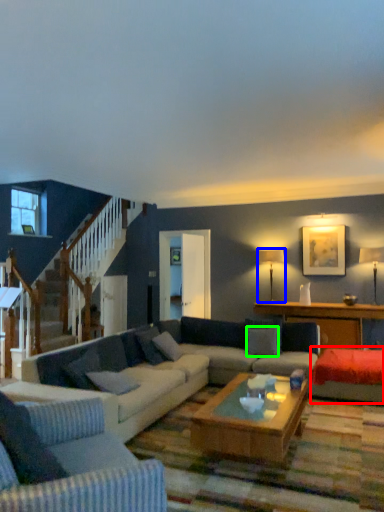
Question: Based on their relative distances, which object is nearer to couch (highlighted by a red box)? Choose from lamp (highlighted by a blue box) and pillow (highlighted by a green box).

Choices:
 (A) lamp
 (B) pillow

Answer: (B)